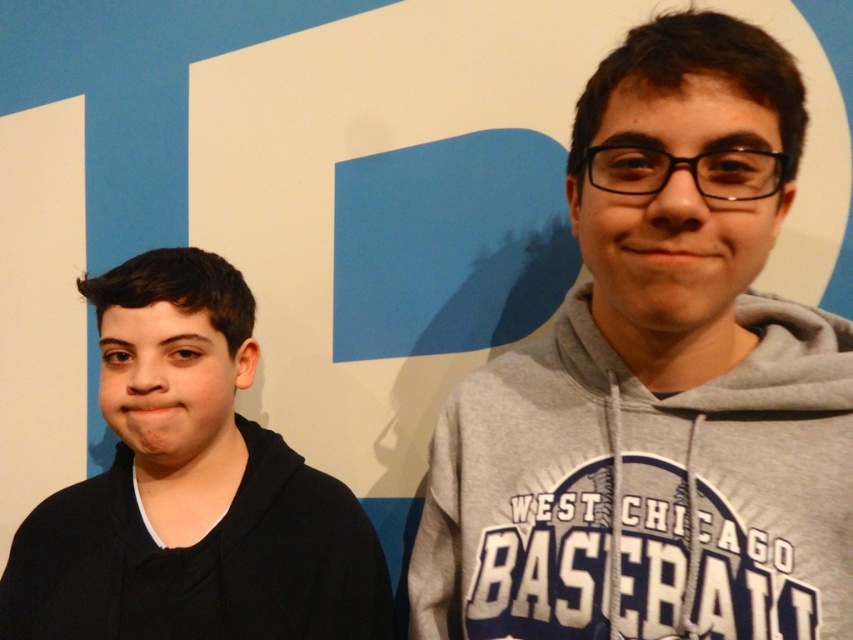
You are designing a poster and need to arrange the gray hoodie at center and the black matte hoodie at left based on their sizes. Which hoodie should you place higher up to maintain visual balance?

The gray hoodie at center is taller than the black matte hoodie at left, so placing the gray hoodie higher up will help maintain visual balance by compensating for its greater height.

You are trying to decide which hoodie to take from the rack. The gray hoodie at center and the black matte hoodie at left are both on the same rack. Which hoodie is closer to the right end of the rack?

The gray hoodie at center is positioned on the right side of black matte hoodie at left, so the gray hoodie at center is closer to the right end of the rack.